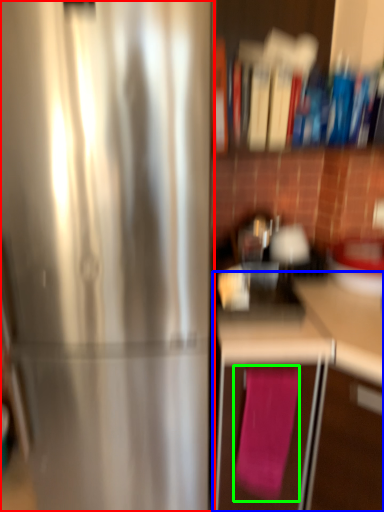
Question: Which is nearer to the refrigerator (highlighted by a red box)? cabinetry (highlighted by a blue box) or bath towel (highlighted by a green box).

Choices:
 (A) cabinetry
 (B) bath towel

Answer: (A)